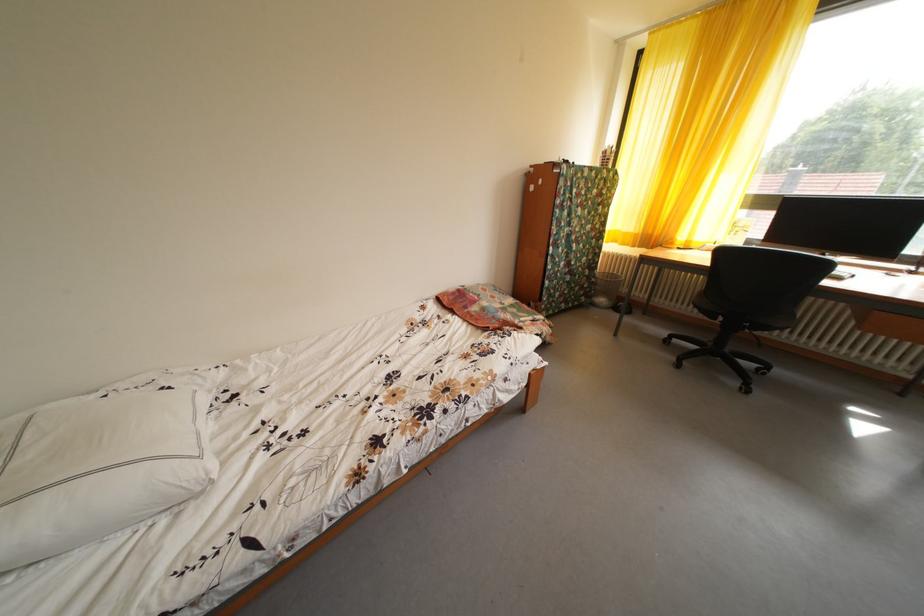
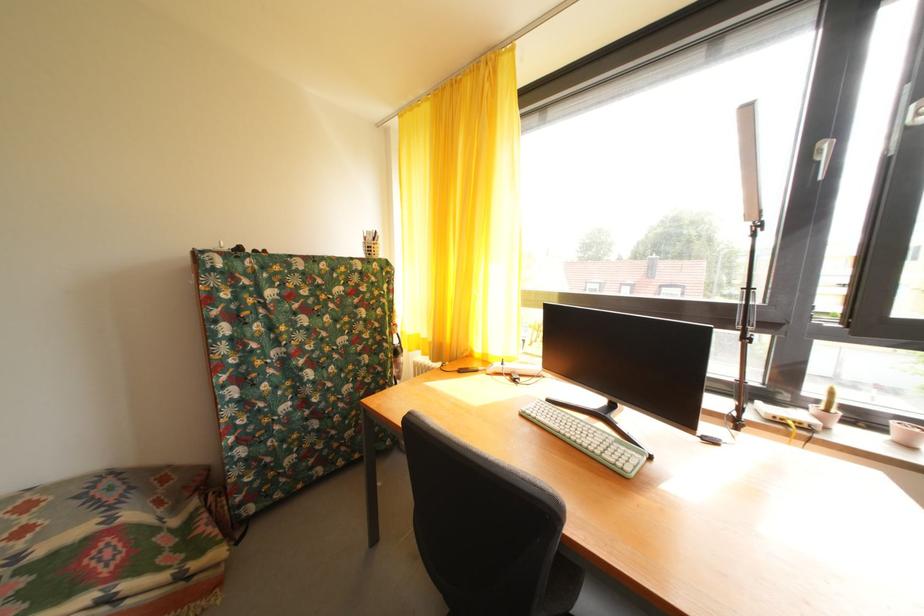
Find the pixel in the second image that matches (635,240) in the first image.

(432, 346)